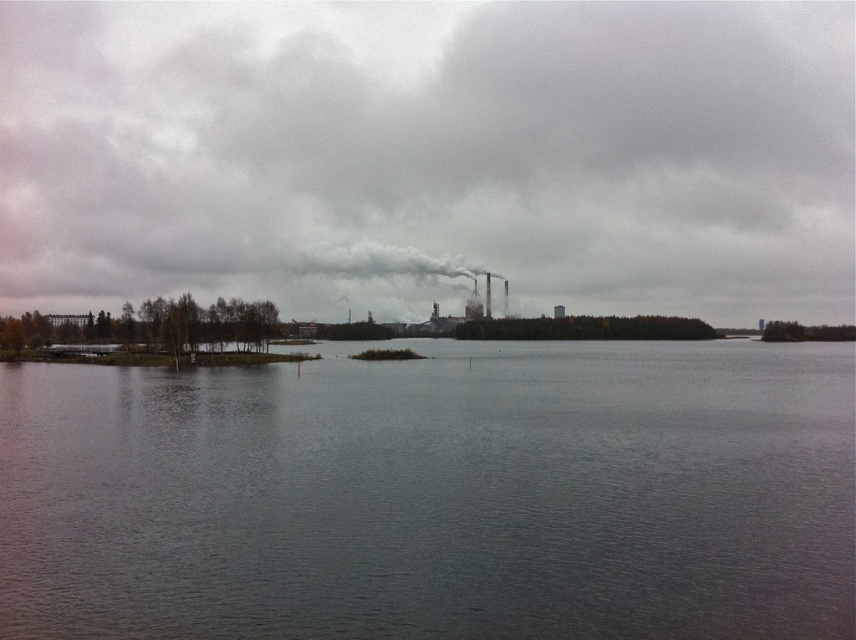
You are a photographer standing at the edge of the water. You want to take a photo that includes both point (394,438) and point (441,262). Which point will appear larger in the photo?

Point (394,438) is closer to the camera than point (441,262), so it will appear larger in the photo.

You are standing at the point marked as point (227, 499) on a map of the lake. You want to swim to the nearest safe shore. The nearest safe shore is 25 meters away from your current position. Can you reach it without exceeding your swimming range of 23 meters?

The distance between point (227, 499) and the camera is 22.72 meters. Since the nearest safe shore is 25 meters away, which is beyond your swimming range of 23 meters, you cannot reach it.